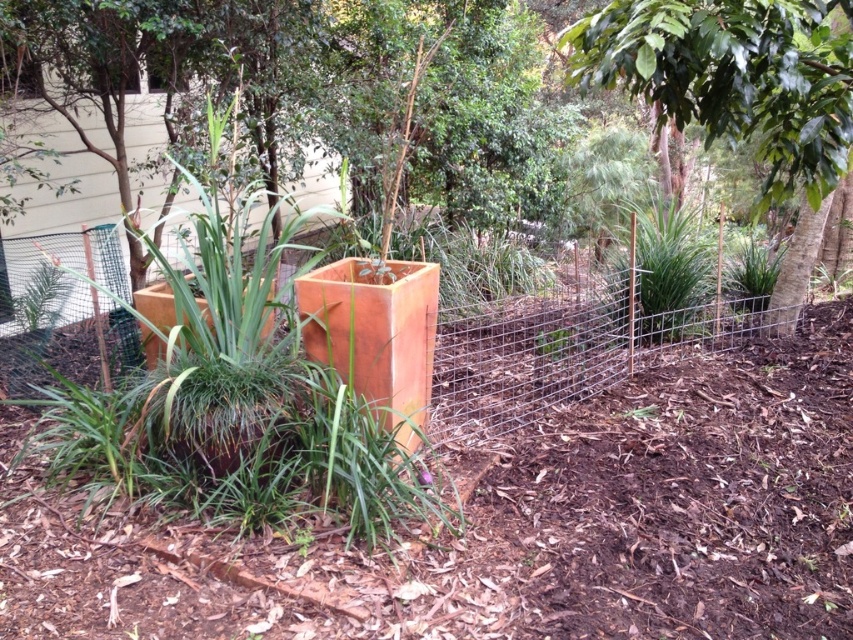
Is point (364, 316) closer to viewer compared to point (241, 385)?

No, it is behind (241, 385).

Between point (364, 292) and point (274, 429), which one is positioned in front?

Point (274, 429) is more forward.

Between point (407, 368) and point (268, 381), which one is positioned behind?

The point (407, 368) is more distant.

Locate an element on the screen. rusty metal planter at center is located at coordinates (375, 333).

Is rusty metal planter at center behind matte orange planter at center?

No.

Does point (381, 308) come behind point (149, 308)?

That is False.

This screenshot has height=640, width=853. Identify the location of rusty metal planter at center. (375, 333).

Is green leafy tree at center further to camera compared to green grass at center?

No, it is not.

Is green leafy tree at center shorter than green grass at center?

No, green leafy tree at center is not shorter than green grass at center.

Does point (677, 120) come in front of point (146, 401)?

No, it is behind (146, 401).

At what (x,y) coordinates should I click in order to perform the action: click on green leafy tree at center. Please return your answer as a coordinate pair (x, y). This screenshot has height=640, width=853. Looking at the image, I should click on (740, 93).